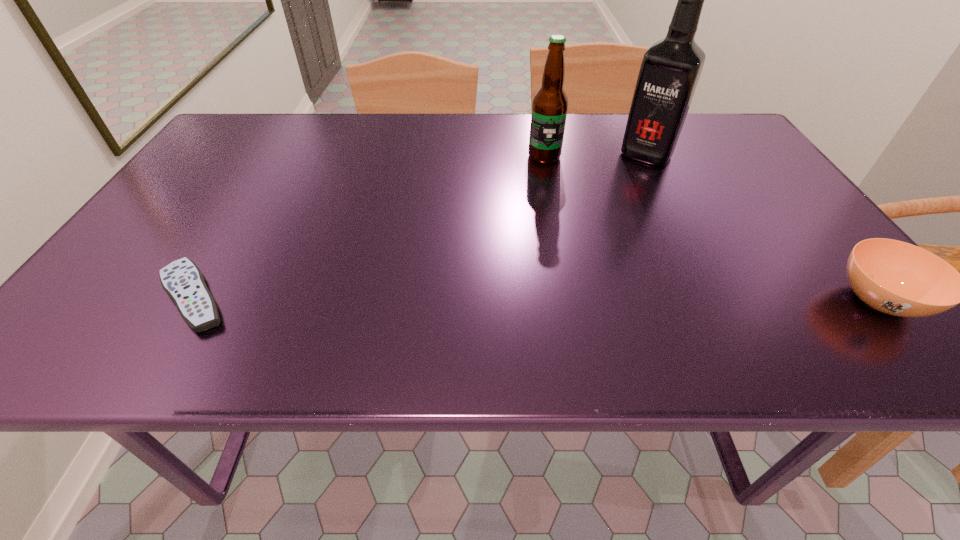
The height and width of the screenshot is (540, 960). I want to click on vacant space in between the shortest object and the third object from right to left, so click(370, 226).

You are a GUI agent. You are given a task and a screenshot of the screen. Output one action in this format:
    pyautogui.click(x=<x>, y=<y>)
    Task: Click on the free space between the beer bottle and the soup bowl
    
    Given the screenshot: What is the action you would take?
    pyautogui.click(x=711, y=228)

You are a GUI agent. You are given a task and a screenshot of the screen. Output one action in this format:
    pyautogui.click(x=<x>, y=<y>)
    Task: Click on the free spot between the second tallest object and the rightmost object
    
    Given the screenshot: What is the action you would take?
    pyautogui.click(x=711, y=228)

Find the location of a particular element. This screenshot has width=960, height=540. free space between the third object from right to left and the rightmost object is located at coordinates (711, 228).

At what (x,y) coordinates should I click in order to perform the action: click on empty location between the second object from right to left and the second tallest object. Please return your answer as a coordinate pair (x, y). Looking at the image, I should click on (595, 156).

Locate an element on the screen. The height and width of the screenshot is (540, 960). free space between the soup bowl and the third object from left to right is located at coordinates (762, 227).

Find the location of `free spot between the tallest object and the leftmost object`. free spot between the tallest object and the leftmost object is located at coordinates (420, 226).

Where is `free space between the liquor and the shortest object`? free space between the liquor and the shortest object is located at coordinates (420, 226).

You are a GUI agent. You are given a task and a screenshot of the screen. Output one action in this format:
    pyautogui.click(x=<x>, y=<y>)
    Task: Click on the empty location between the beer bottle and the soup bowl
    This screenshot has width=960, height=540.
    Given the screenshot: What is the action you would take?
    pyautogui.click(x=711, y=228)

Locate an element on the screen. The image size is (960, 540). empty space between the third shortest object and the liquor is located at coordinates (595, 156).